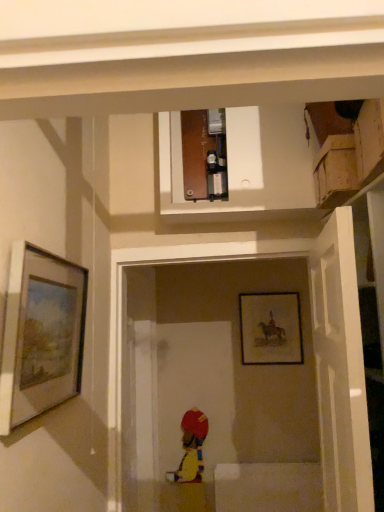
Question: Is white matte door at right to the left of matte silver picture frame at left, placed as the first picture frame when sorted from left to right, from the viewer's perspective?

Choices:
 (A) yes
 (B) no

Answer: (B)

Question: From a real-world perspective, is white matte door at right located higher than matte silver picture frame at left, the first picture frame in the front-to-back sequence?

Choices:
 (A) no
 (B) yes

Answer: (A)

Question: Is white matte door at right wider than matte silver picture frame at left, placed as the first picture frame when sorted from left to right?

Choices:
 (A) yes
 (B) no

Answer: (A)

Question: Considering the relative sizes of white matte door at right and matte silver picture frame at left, positioned as the second picture frame in back-to-front order, in the image provided, is white matte door at right shorter than matte silver picture frame at left, positioned as the second picture frame in back-to-front order,?

Choices:
 (A) no
 (B) yes

Answer: (A)

Question: Does white matte door at right come in front of matte silver picture frame at left, the 2th picture frame in the right-to-left sequence?

Choices:
 (A) no
 (B) yes

Answer: (B)

Question: In terms of height, does white matte door at right look taller or shorter compared to matte black picture frame at center, the 1th picture frame from the right?

Choices:
 (A) tall
 (B) short

Answer: (A)

Question: Which is correct: white matte door at right is inside matte black picture frame at center, marked as the 1th picture frame in a back-to-front arrangement, or outside of it?

Choices:
 (A) inside
 (B) outside

Answer: (B)

Question: In terms of size, does white matte door at right appear bigger or smaller than matte black picture frame at center, which appears as the second picture frame when viewed from the front?

Choices:
 (A) big
 (B) small

Answer: (A)

Question: Considering the positions of white matte door at right and matte black picture frame at center, which appears as the second picture frame when viewed from the front, in the image, is white matte door at right wider or thinner than matte black picture frame at center, which appears as the second picture frame when viewed from the front,?

Choices:
 (A) wide
 (B) thin

Answer: (A)

Question: From a real-world perspective, is matte silver picture frame at left, placed as the first picture frame when sorted from left to right, positioned above or below matte black picture frame at center, the 1th picture frame from the right?

Choices:
 (A) above
 (B) below

Answer: (A)

Question: In the image, is matte silver picture frame at left, placed as the first picture frame when sorted from left to right, on the left side or the right side of matte black picture frame at center, which appears as the second picture frame when viewed from the front?

Choices:
 (A) right
 (B) left

Answer: (B)

Question: In terms of width, does matte silver picture frame at left, placed as the first picture frame when sorted from left to right, look wider or thinner when compared to matte black picture frame at center, the 1th picture frame from the right?

Choices:
 (A) wide
 (B) thin

Answer: (A)

Question: Choose the correct answer: Is matte silver picture frame at left, positioned as the second picture frame in back-to-front order, inside matte black picture frame at center, marked as the 1th picture frame in a back-to-front arrangement, or outside it?

Choices:
 (A) inside
 (B) outside

Answer: (B)

Question: Which is correct: matte black picture frame at center, which is counted as the 2th picture frame, starting from the left, is inside white matte door at right, or outside of it?

Choices:
 (A) outside
 (B) inside

Answer: (A)

Question: Considering the positions of point (254, 361) and point (319, 431), is point (254, 361) closer or farther from the camera than point (319, 431)?

Choices:
 (A) closer
 (B) farther

Answer: (B)